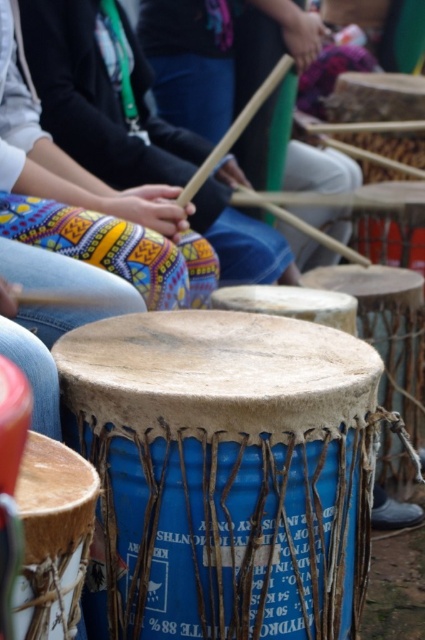
Is blue fabric drum at center taller than blue fabric drum at lower left?

No.

Which is more to the right, blue fabric drum at center or blue fabric drum at lower left?

blue fabric drum at lower left is more to the right.

Does point (39, 477) come behind point (0, 362)?

Yes.

Locate an element on the screen. This screenshot has width=425, height=640. blue fabric drum at center is located at coordinates (53, 538).

Can you confirm if blue textured drum at center is positioned to the right of blue fabric drum at lower left?

Correct, you'll find blue textured drum at center to the right of blue fabric drum at lower left.

Between blue textured drum at center and blue fabric drum at lower left, which one has more height?

blue textured drum at center is taller.

The height and width of the screenshot is (640, 425). What are the coordinates of `blue textured drum at center` in the screenshot? It's located at (387, 326).

Does patterned fabric pants at lower left have a lesser height compared to blue fabric drum at center?

In fact, patterned fabric pants at lower left may be taller than blue fabric drum at center.

Does patterned fabric pants at lower left have a greater width compared to blue fabric drum at center?

Indeed, patterned fabric pants at lower left has a greater width compared to blue fabric drum at center.

I want to click on patterned fabric pants at lower left, so click(101, 99).

This screenshot has width=425, height=640. What are the coordinates of `patterned fabric pants at lower left` in the screenshot? It's located at (101, 99).